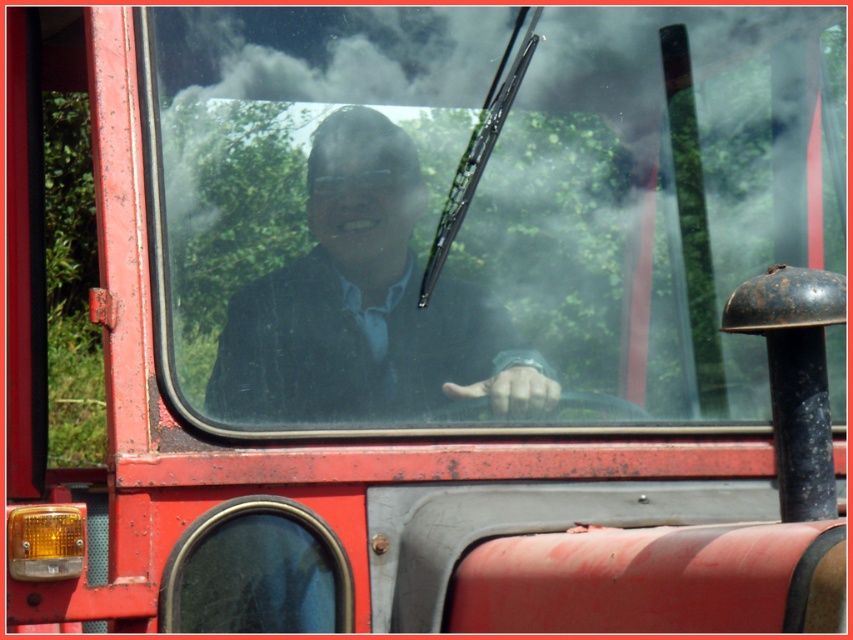
You are a mechanic inspecting a vehicle. You notice the clear glass windshield at center and the matte black suit at center. Which object would you need to clean more thoroughly if they both have the same amount of dirt, and why?

The clear glass windshield at center has a larger size compared to the matte black suit at center, so it would require more thorough cleaning to remove the same amount of dirt spread over a bigger area.

You are a passenger in the red vehicle and want to look out through the clear glass windshield at center. However, there is a matte black suit at center blocking your view. Which object should you move to the left to see through the windshield?

You should move the matte black suit at center to the left so that the clear glass windshield at center is no longer blocked.

You are a photographer trying to capture a portrait of the person inside the red vehicle. The clear glass windshield at center and the matte black suit at center are both in your view. Which object will appear larger in your photo?

The clear glass windshield at center will appear larger in the photo because it is much taller than the matte black suit at center.